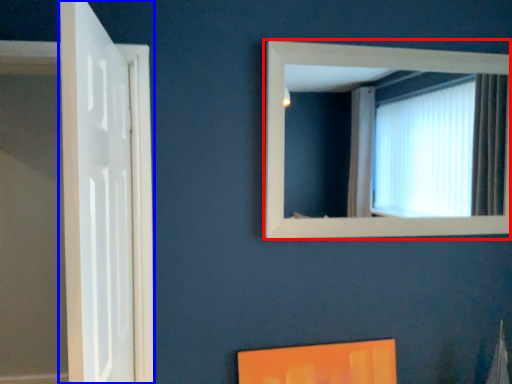
Question: Which point is closer to the camera, window (highlighted by a red box) or door (highlighted by a blue box)?

Choices:
 (A) window
 (B) door

Answer: (B)